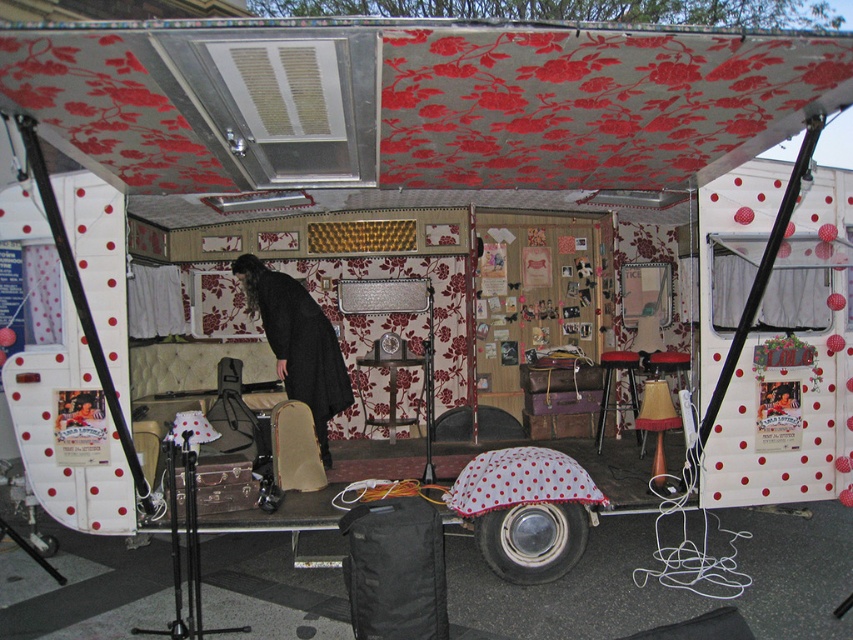
In the scene shown: Is white polka dot fabric umbrella at center above red fabric stool at center?

No, white polka dot fabric umbrella at center is not above red fabric stool at center.

Is white polka dot fabric umbrella at center bigger than red fabric stool at center?

No.

Who is more distant from viewer, [517,467] or [621,365]?

Point [621,365]

At what (x,y) coordinates should I click in order to perform the action: click on white polka dot fabric umbrella at center. Please return your answer as a coordinate pair (x, y). The height and width of the screenshot is (640, 853). Looking at the image, I should click on (519, 481).